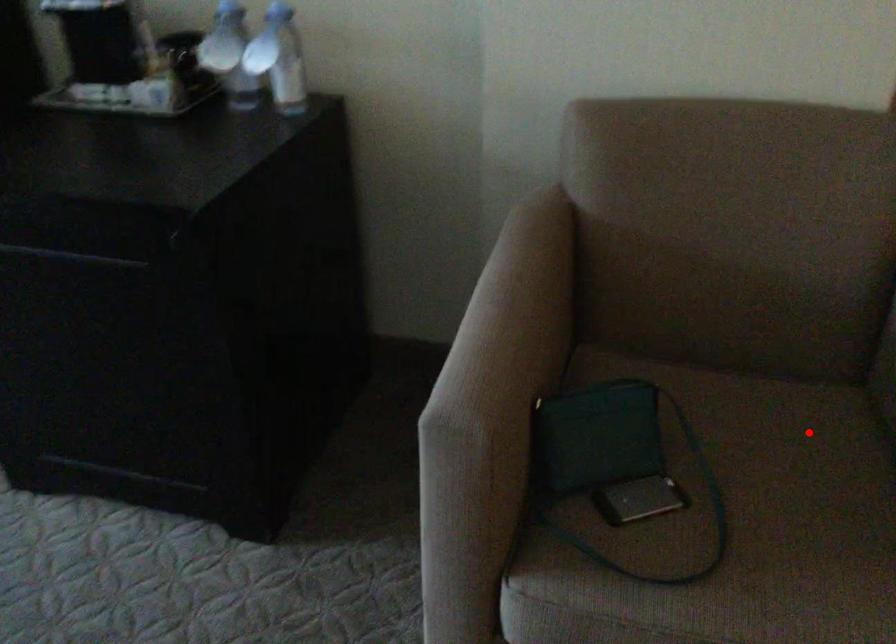
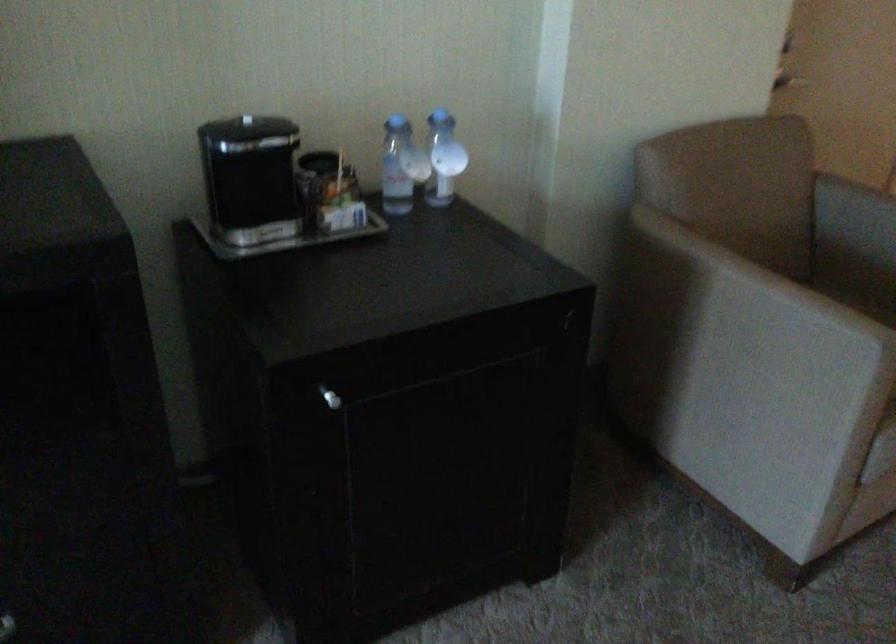
Question: I am providing you with two images of the same scene from different viewpoints. Given a red point in image1, look at the same physical point in image2. Is it:

Choices:
 (A) Closer to the viewpoint
 (B) Farther from the viewpoint

Answer: (B)